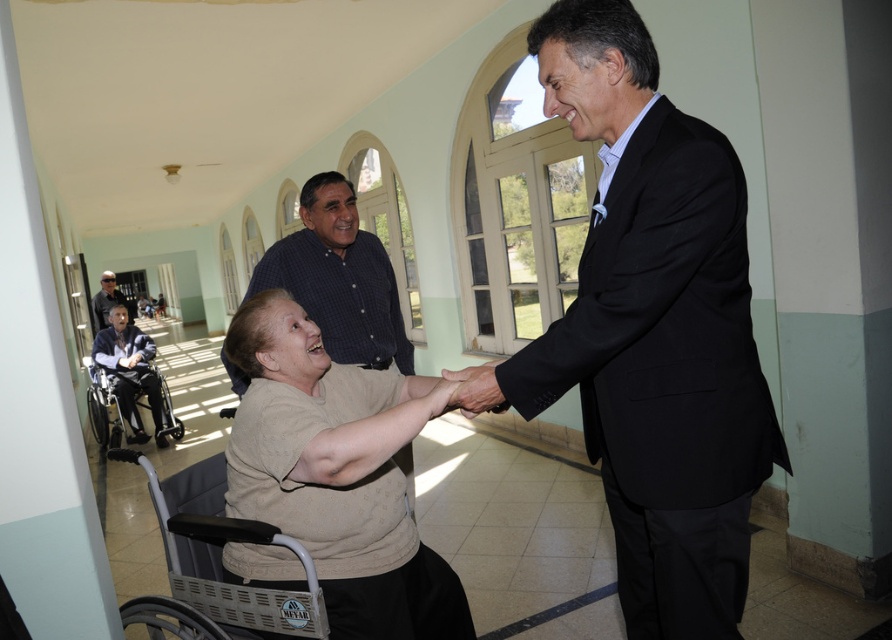
You are a security guard in the corridor and need to locate the black suit at center. Where exactly is it located?

The black suit at center is located at point 0.517 on the x axis and 0.735 on the y axis.

You are a photographer setting up for a group photo. The scene includes a smooth skin hand at center and a dark blue shirt at center. Which object should you focus on first if you want to capture the smaller one?

The smooth skin hand at center has a smaller size compared to the dark blue shirt at center, so you should focus on the smooth skin hand at center first.